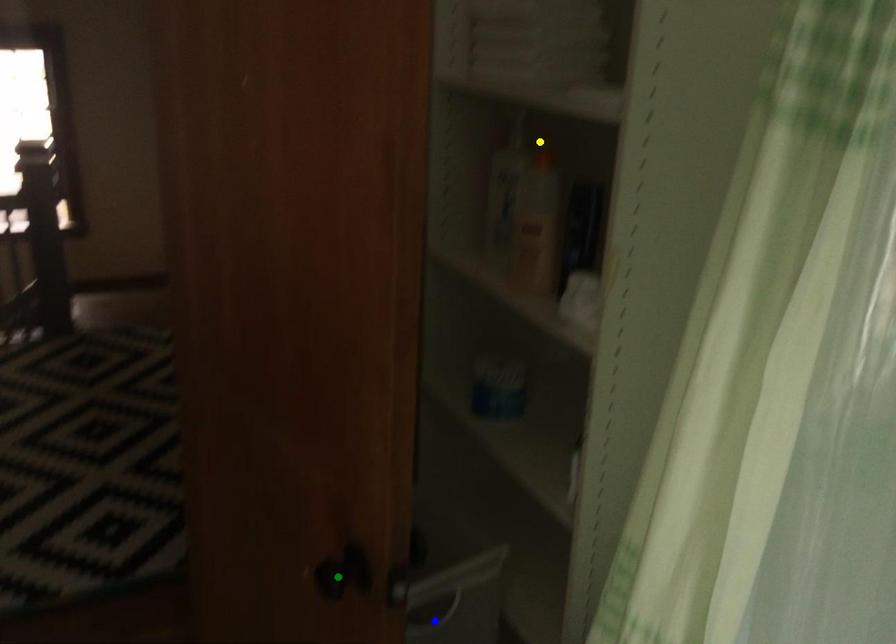
Order these from farthest to nearest:
1. blue point
2. yellow point
3. green point

yellow point → blue point → green point